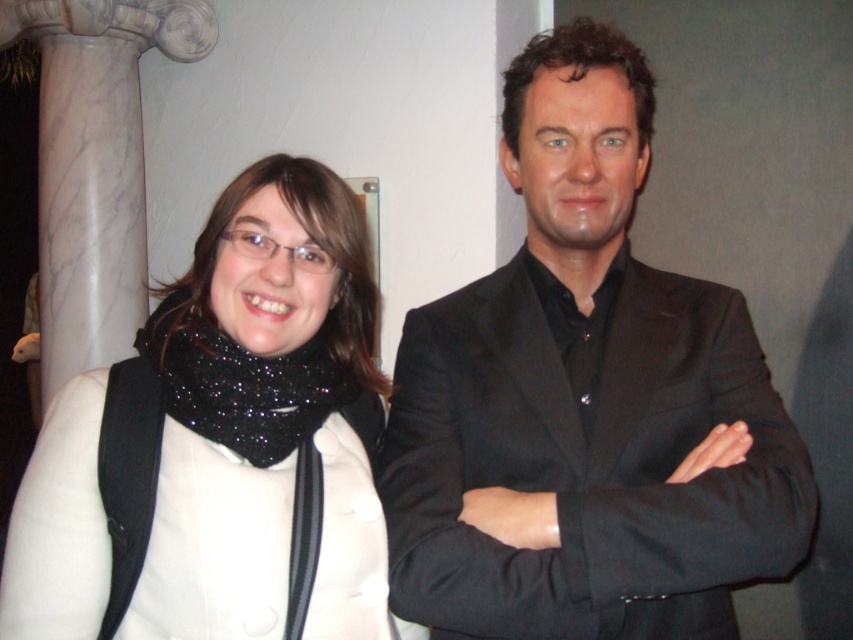
You are trying to decide which item to pack first for a trip. You have the black matte suit at center and the white matte scarf at left. Which item takes up more space?

The black matte suit at center is bigger than the white matte scarf at left, so it takes up more space.

What are the coordinates of the black matte suit at center?

The coordinates of the black matte suit at center are at point (585, 401).